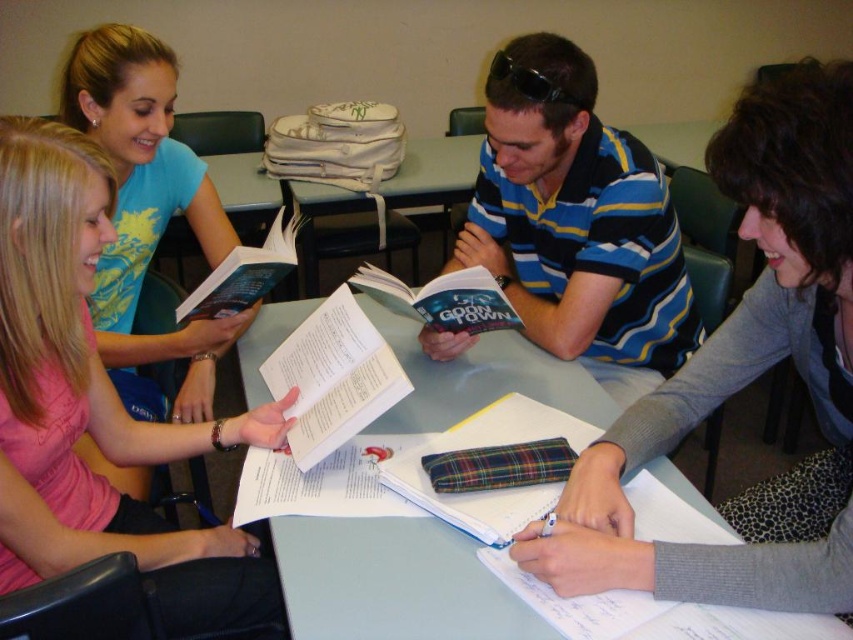
You are a student trying to place your textbook on the table. Based on the scene, can you confirm if the white paper book at center will fit on the light gray plastic table at center?

The light gray plastic table at center is below white paper book at center, so the white paper book at center is placed on the table. Therefore, the white paper book at center fits on the light gray plastic table at center.

You are organizing a study group and need to ensure that everyone has enough space. The striped cotton shirt at center and the white paper book at center are both on the table. Which object takes up more space on the table?

The striped cotton shirt at center has a larger size compared to the white paper book at center, so it takes up more space on the table.